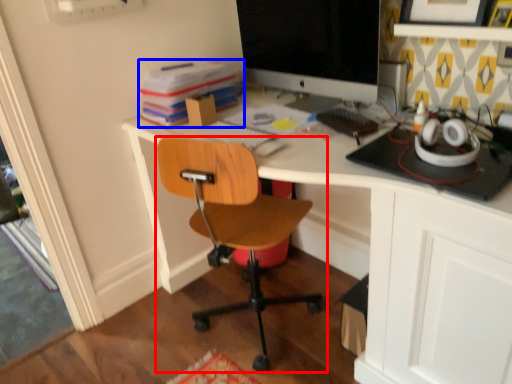
Question: Which of the following is the farthest to the observer, chair (highlighted by a red box) or book (highlighted by a blue box)?

Choices:
 (A) chair
 (B) book

Answer: (B)